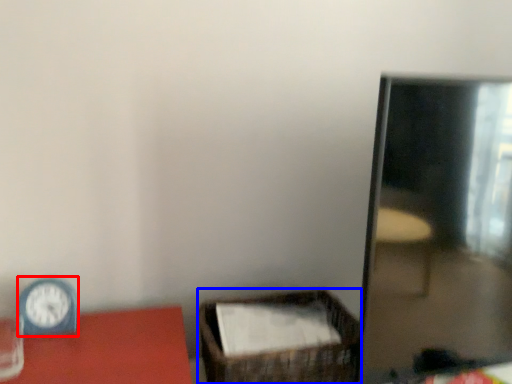
Question: Which object appears farthest to the camera in this image, clock (highlighted by a red box) or basket (highlighted by a blue box)?

Choices:
 (A) clock
 (B) basket

Answer: (B)